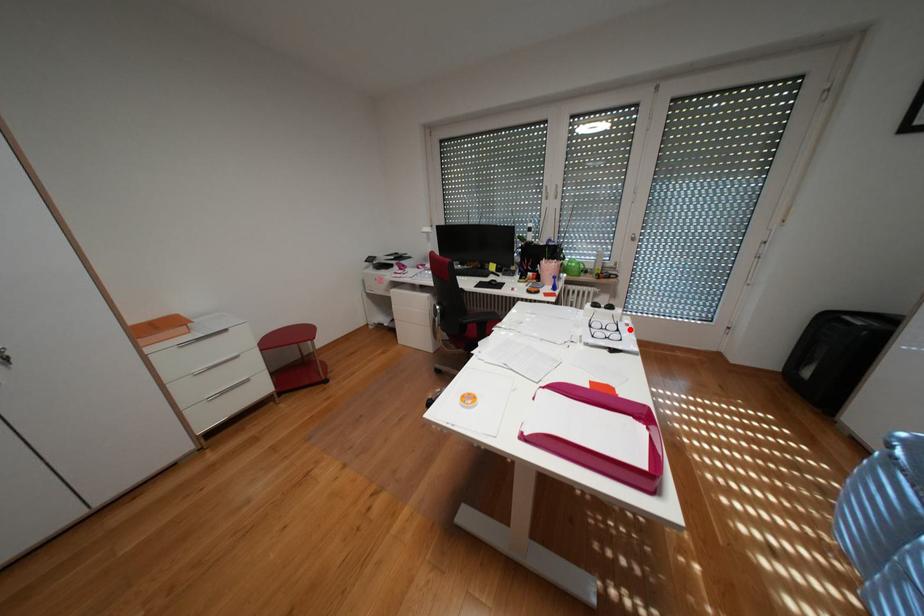
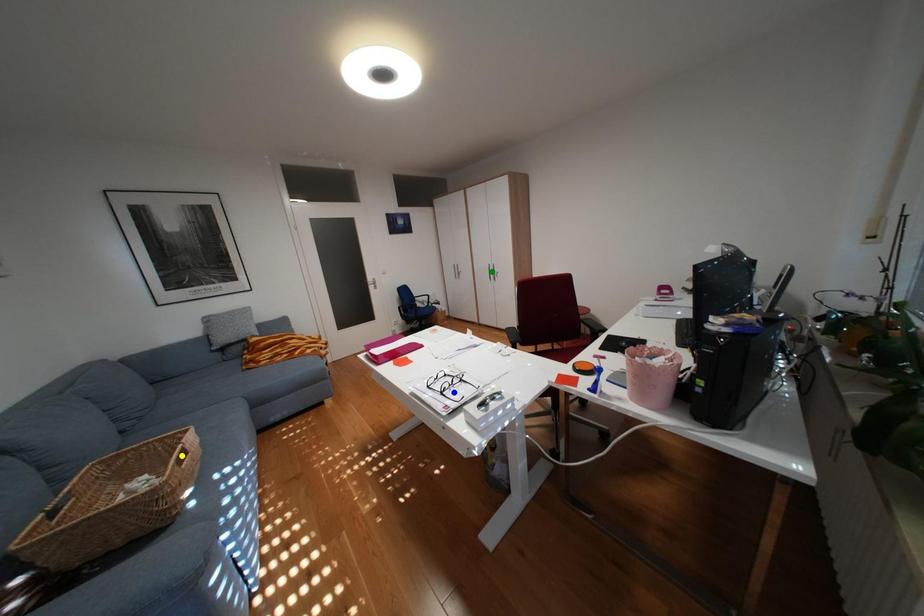
Question: I am providing you with two images of the same scene from different viewpoints. A red point is marked on the first image. You are given multiple points on the second image. Which spot in image 2 lines up with the point in image 1?

Choices:
 (A) blue point
 (B) green point
 (C) yellow point

Answer: (A)